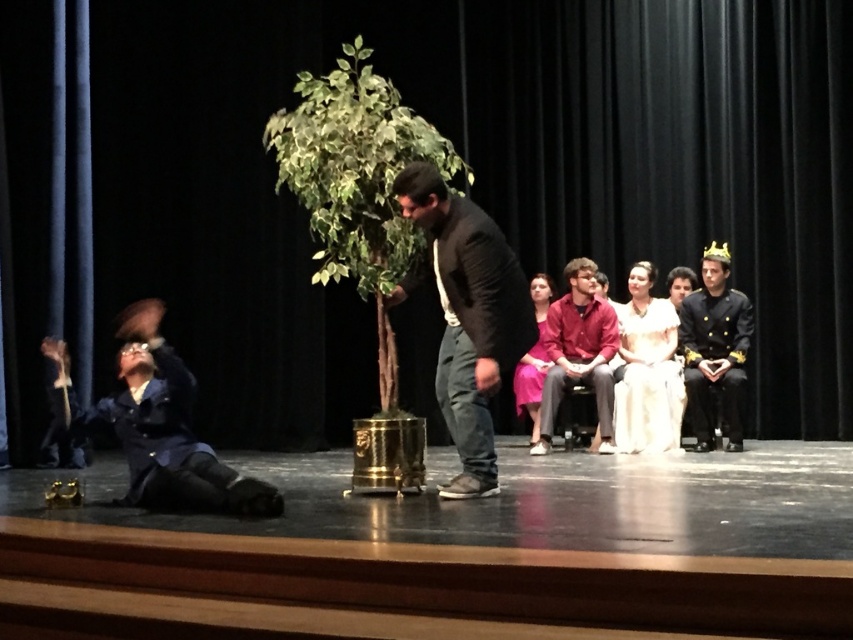
You are a stagehand setting up for a play. You need to place a prop on the stage such that it is directly in front of the dark gray sweater at center. Where should you position the prop in terms of coordinates?

The prop should be placed at the coordinates provided by the dark gray sweater at center, which is at point (469, 317), to ensure it is directly in front of it.

You are directing a play and need to adjust the lighting. The spotlight needs to focus on the green leafy plant at center. Where should you position the spotlight relative to the plant?

The green leafy plant at center is located at point (357, 182), so the spotlight should be positioned directly above or in front of this coordinate to effectively illuminate the plant.

You are an actor on stage and need to quickly grab the dark gray sweater at center during a scene. Based on the stage setup, where should you move to find it?

The dark gray sweater at center is located at the coordinates point (469, 317), so move to that position to find it.